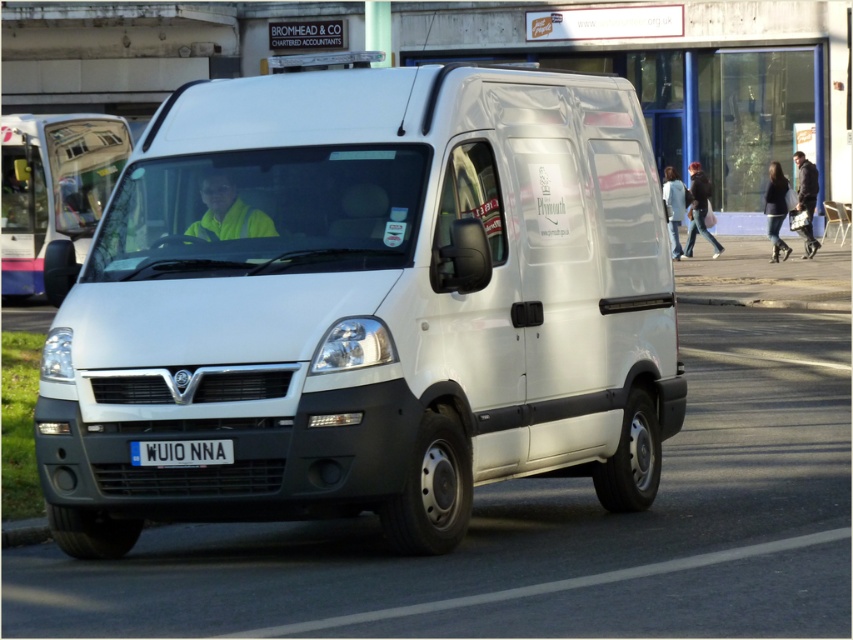
You are a traffic officer observing a white matte van at center and a white plastic license plate at center. Which object is positioned higher in the image?

The white matte van at center is located above the white plastic license plate at center, so the white matte van at center is positioned higher in the image.

You are a pedestrian standing at the roadside and see the matte white van at center and the white plastic license plate at center. Which object is closer to you?

The matte white van at center is closer to you because the white plastic license plate at center is positioned behind it.

You are a delivery driver who needs to park your white matte van at center in a parking spot that is exactly the same width as your white plastic license plate at center. Will the van fit in the parking spot?

The white matte van at center is wider than the white plastic license plate at center, so it will not fit in the parking spot designed for the license plate width.